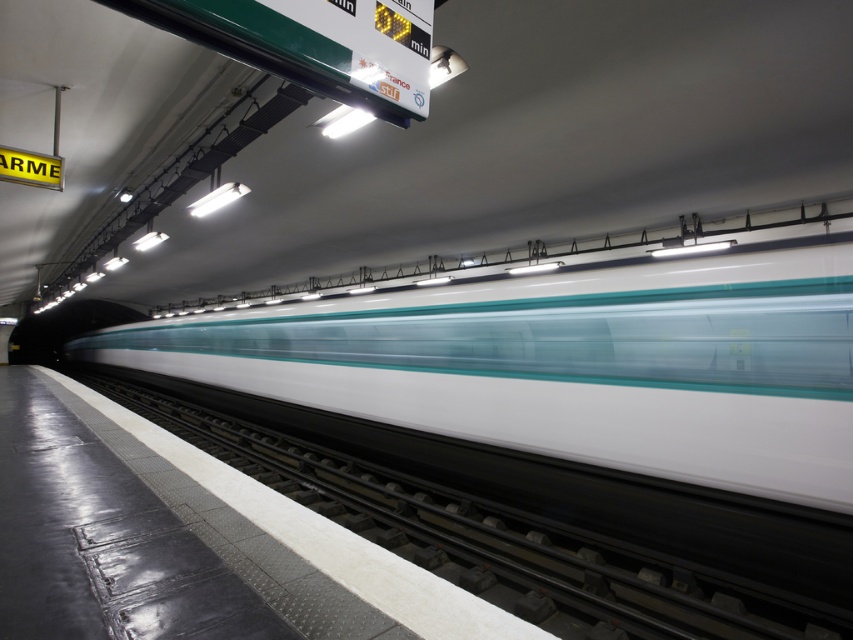
Question: Which point is closer to the camera taking this photo?

Choices:
 (A) (212, 433)
 (B) (440, 371)

Answer: (B)

Question: Can you confirm if white glossy train at center is smaller than metallic gray train track at center?

Choices:
 (A) no
 (B) yes

Answer: (A)

Question: Can you confirm if white glossy train at center is smaller than metallic gray train track at center?

Choices:
 (A) no
 (B) yes

Answer: (A)

Question: Which object is farther from the camera taking this photo?

Choices:
 (A) white glossy train at center
 (B) metallic gray train track at center

Answer: (A)

Question: Is the position of white glossy train at center less distant than that of metallic gray train track at center?

Choices:
 (A) yes
 (B) no

Answer: (B)